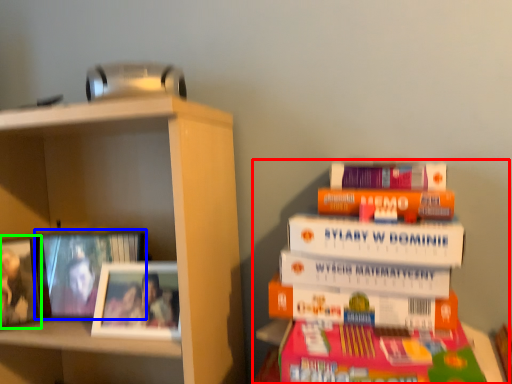
Question: Based on their relative distances, which object is farther from book (highlighted by a red box)? Choose from picture frame (highlighted by a blue box) and picture frame (highlighted by a green box).

Choices:
 (A) picture frame
 (B) picture frame

Answer: (B)